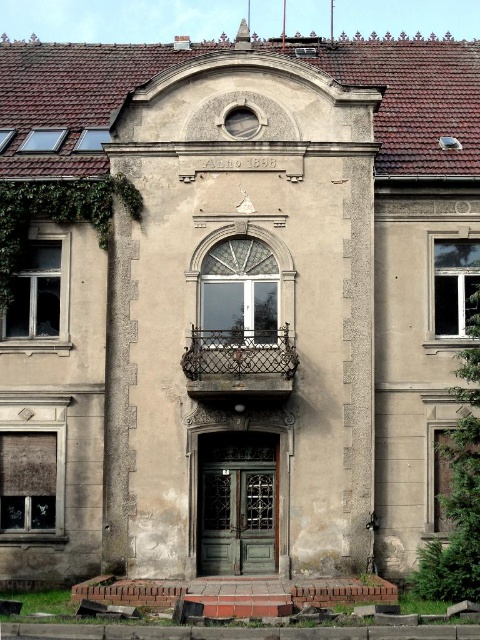
You are a gardener who needs to trim the green ivy at right. The balcony above might be unstable. Is the ivy positioned below the rusty metal balcony at center?

Yes, the green ivy at right is below the rusty metal balcony at center, so you should be cautious when trimming to avoid disturbing the balcony.

You are standing in front of the building and want to touch both points marked on the facade. Which point should you reach for first, the point at coordinates (58, 220) or the point at (255, 371)?

You should reach for the point at coordinates (58, 220) first because it is closer to you than the point at (255, 371), which is further away.